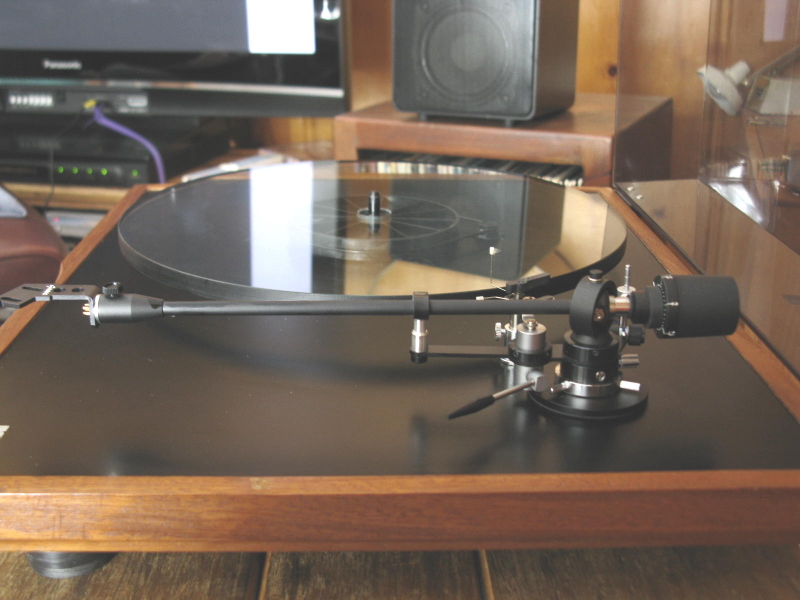
In order to click on speaker in this screenshot , I will do `click(502, 65)`.